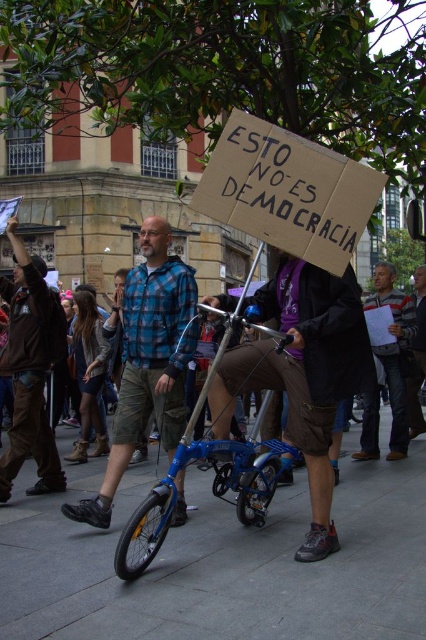
You are a photographer trying to capture the protest scene. You notice the slate gray pavement at lower center and the dark gray jeans at center. Which object takes up more area in the image?

The dark gray jeans at center occupies more space than the slate gray pavement at lower center, so the jeans take up more area in the image.

You are a photographer trying to capture both the blue plaid shirt at center and the brown leather jacket at left in a single frame. Based on their sizes, which object should you focus on to ensure both fit in the photo?

The blue plaid shirt at center is wider than the brown leather jacket at left, so focusing on the blue plaid shirt at center would help ensure both fit in the photo since it occupies more space.

You are a photographer trying to capture a clear shot of the blue plaid shirt at center and the brown leather jacket at left. Which object should you focus on first to ensure both are in frame?

The blue plaid shirt at center is positioned under the brown leather jacket at left, so you should focus on the brown leather jacket at left first to ensure both are in frame.